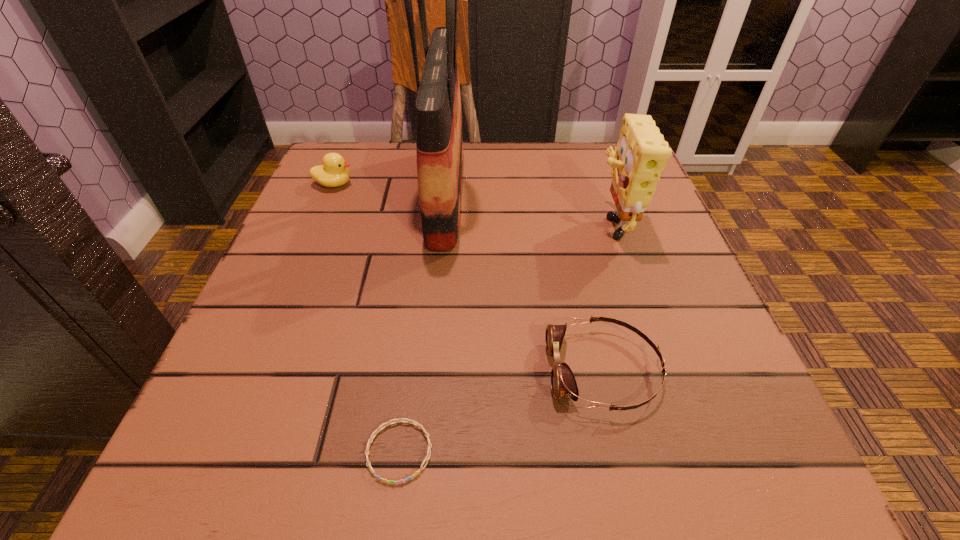
Locate an element on the screen. free space at the near left corner is located at coordinates (222, 481).

Locate an element on the screen. blank area at the far right corner is located at coordinates (567, 143).

Where is `vacant space in between the shopping bag and the leftmost object`? vacant space in between the shopping bag and the leftmost object is located at coordinates (390, 189).

At what (x,y) coordinates should I click in order to perform the action: click on empty location between the goggles and the sponge. Please return your answer as a coordinate pair (x, y). Looking at the image, I should click on (607, 296).

At what (x,y) coordinates should I click in order to perform the action: click on free point between the shortest object and the shopping bag. Please return your answer as a coordinate pair (x, y). Looking at the image, I should click on (422, 323).

Locate an element on the screen. The width and height of the screenshot is (960, 540). unoccupied position between the fourth shortest object and the duckling is located at coordinates (472, 203).

Find the location of a particular element. free spot between the goggles and the shopping bag is located at coordinates (524, 282).

Locate an element on the screen. Image resolution: width=960 pixels, height=540 pixels. free space between the nearest object and the duckling is located at coordinates (367, 318).

The image size is (960, 540). Identify the location of blank region between the tallest object and the fourth shortest object. (528, 208).

This screenshot has height=540, width=960. Identify the location of vacant area that lies between the tallest object and the second tallest object. (528, 208).